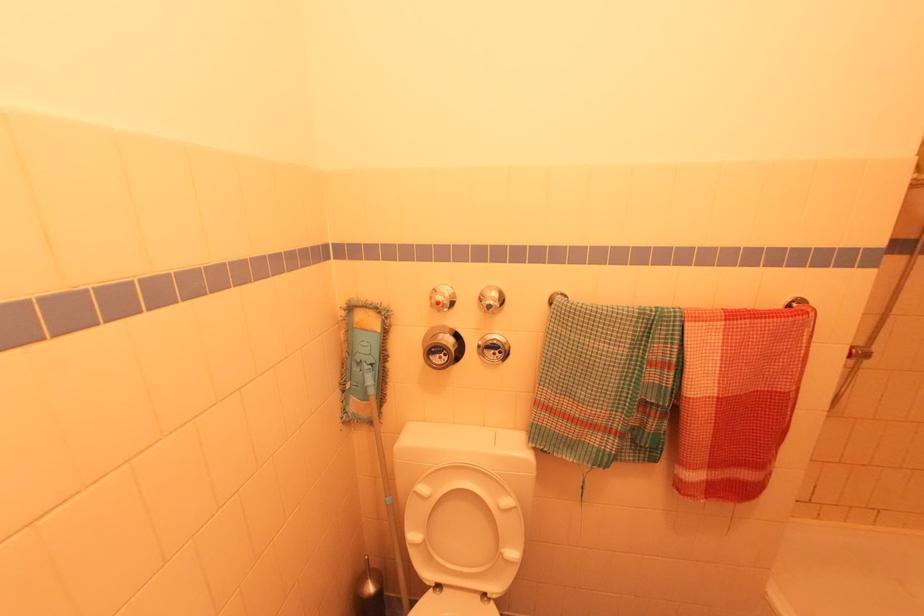
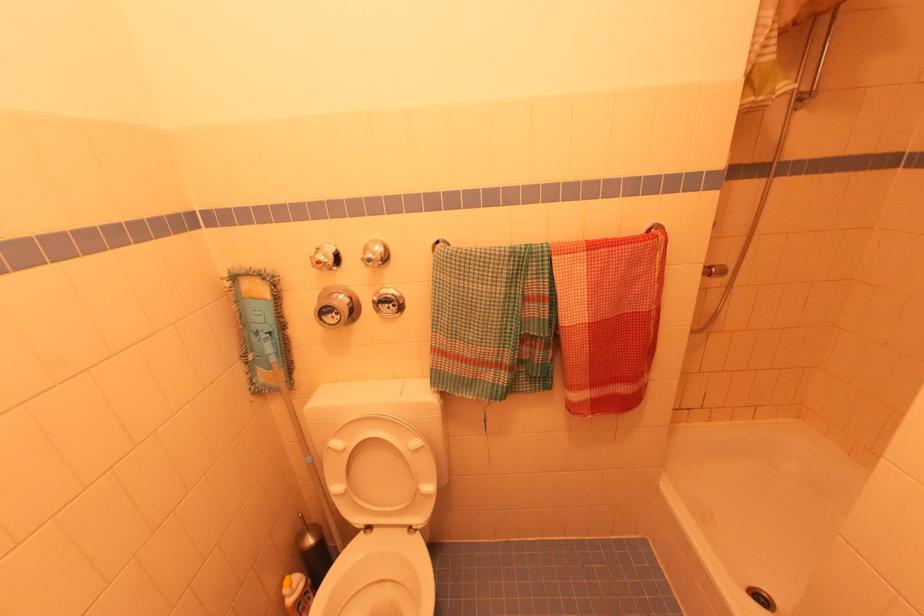
In the second image, find the point that corresponds to pixel 502 353 in the first image.

(395, 306)